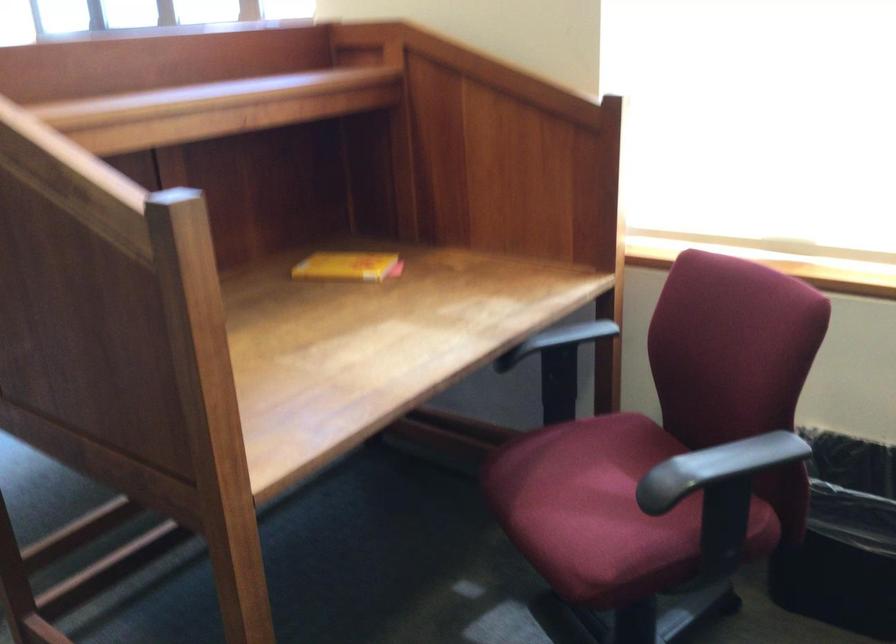
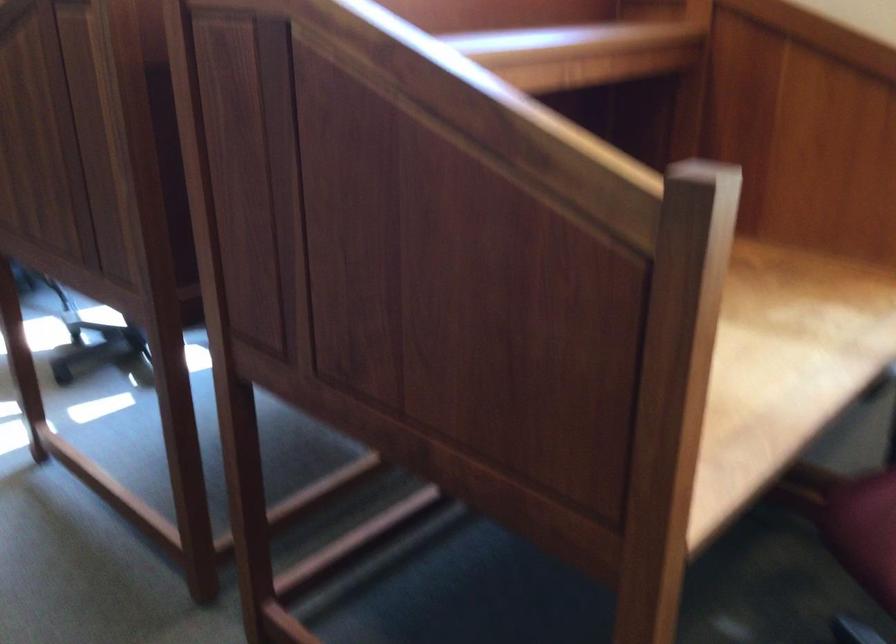
Question: How did the camera likely rotate?

Choices:
 (A) Left
 (B) Right
 (C) Up
 (D) Down

Answer: (A)